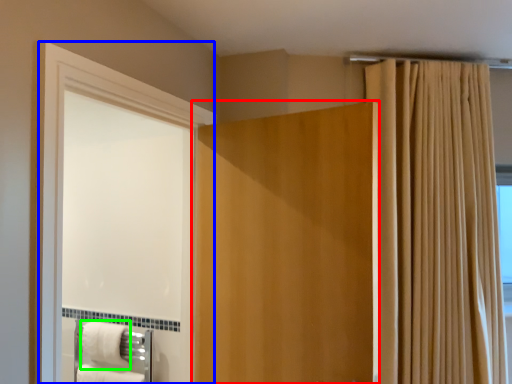
Question: Which object is the farthest from door (highlighted by a red box)? Choose among these: screen door (highlighted by a blue box) or bath towel (highlighted by a green box).

Choices:
 (A) screen door
 (B) bath towel

Answer: (B)